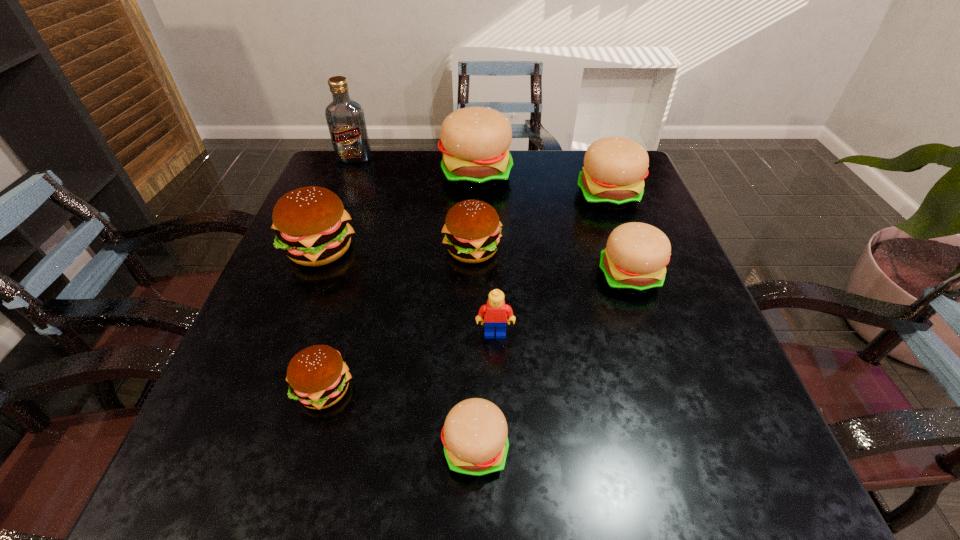
Locate an element on the screen. The image size is (960, 540). object that is the seventh closest to the seventh farthest object is located at coordinates (475, 141).

Choose which hamburger is the nearest neighbor to the biggest beige hamburger. Please provide its 2D coordinates. Your answer should be formatted as a tuple, i.e. [(x, y)], where the tuple contains the x and y coordinates of a point satisfying the conditions above.

[(472, 229)]

Select which hamburger is the second closest to the vodka. Please provide its 2D coordinates. Your answer should be formatted as a tuple, i.e. [(x, y)], where the tuple contains the x and y coordinates of a point satisfying the conditions above.

[(310, 223)]

Select which beige hamburger appears as the fourth closest to the second biggest brown hamburger. Please provide its 2D coordinates. Your answer should be formatted as a tuple, i.e. [(x, y)], where the tuple contains the x and y coordinates of a point satisfying the conditions above.

[(474, 435)]

Where is `beige hamburger identified as the fourth closest to the third nearest object`? The width and height of the screenshot is (960, 540). beige hamburger identified as the fourth closest to the third nearest object is located at coordinates (475, 141).

The image size is (960, 540). What are the coordinates of `the closest brown hamburger to the rightmost brown hamburger` in the screenshot? It's located at (x=310, y=223).

You are a GUI agent. You are given a task and a screenshot of the screen. Output one action in this format:
    pyautogui.click(x=<x>, y=<y>)
    Task: Click on the brown hamburger that is the nearest to the second biggest beige hamburger
    This screenshot has height=540, width=960.
    Given the screenshot: What is the action you would take?
    tap(472, 229)

Where is `vacant region that satisfies the following two spatial constraints: 1. on the back side of the smallest brown hamburger; 2. on the right side of the second biggest beige hamburger`? The width and height of the screenshot is (960, 540). vacant region that satisfies the following two spatial constraints: 1. on the back side of the smallest brown hamburger; 2. on the right side of the second biggest beige hamburger is located at coordinates (378, 195).

Locate an element on the screen. The height and width of the screenshot is (540, 960). free space that satisfies the following two spatial constraints: 1. on the front side of the third biggest beige hamburger; 2. on the left side of the biggest beige hamburger is located at coordinates (475, 276).